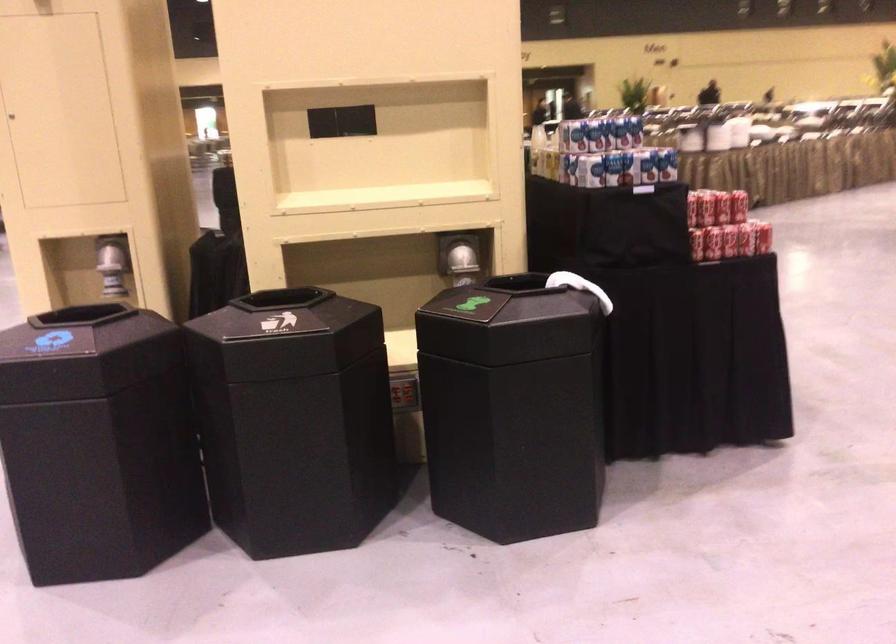
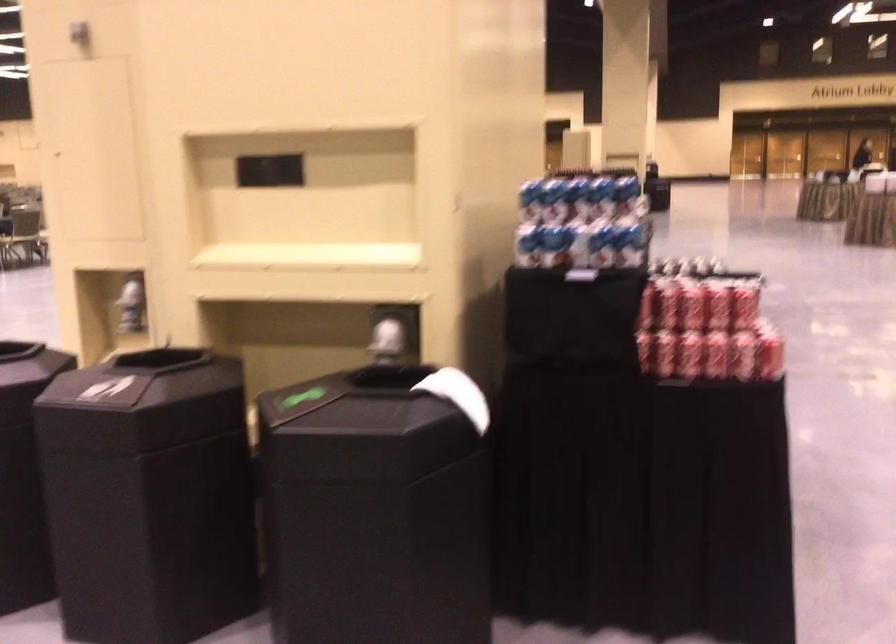
Where in the second image is the point corresponding to (x=596, y=169) from the first image?

(528, 245)